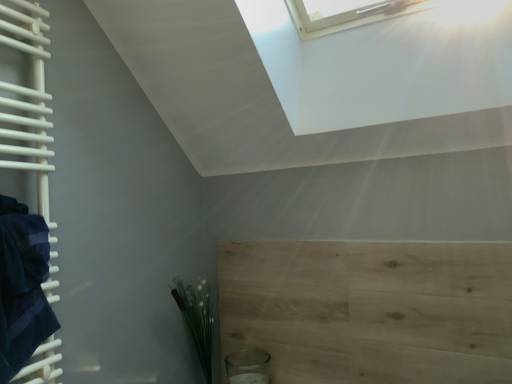
Question: Are green matte plant at lower left and dark blue towel at left far apart?

Choices:
 (A) yes
 (B) no

Answer: (B)

Question: Can you confirm if green matte plant at lower left is positioned to the left of dark blue towel at left?

Choices:
 (A) yes
 (B) no

Answer: (B)

Question: Can you confirm if green matte plant at lower left is shorter than dark blue towel at left?

Choices:
 (A) yes
 (B) no

Answer: (A)

Question: Does green matte plant at lower left lie in front of dark blue towel at left?

Choices:
 (A) yes
 (B) no

Answer: (B)

Question: Is green matte plant at lower left oriented towards dark blue towel at left?

Choices:
 (A) no
 (B) yes

Answer: (B)

Question: Looking at their shapes, would you say green matte plant at lower left is wider or thinner than dark blue towel at left?

Choices:
 (A) wide
 (B) thin

Answer: (A)

Question: Is green matte plant at lower left bigger or smaller than dark blue towel at left?

Choices:
 (A) big
 (B) small

Answer: (B)

Question: From the image's perspective, relative to dark blue towel at left, is green matte plant at lower left above or below?

Choices:
 (A) above
 (B) below

Answer: (B)

Question: Choose the correct answer: Is green matte plant at lower left inside dark blue towel at left or outside it?

Choices:
 (A) outside
 (B) inside

Answer: (A)

Question: Relative to green matte plant at lower left, is light wood plywood at lower right in front or behind?

Choices:
 (A) front
 (B) behind

Answer: (A)

Question: Is light wood plywood at lower right to the left or to the right of green matte plant at lower left in the image?

Choices:
 (A) right
 (B) left

Answer: (A)

Question: Is light wood plywood at lower right inside or outside of green matte plant at lower left?

Choices:
 (A) inside
 (B) outside

Answer: (B)

Question: Is light wood plywood at lower right taller or shorter than green matte plant at lower left?

Choices:
 (A) tall
 (B) short

Answer: (A)

Question: Is green matte plant at lower left spatially inside light wood plywood at lower right, or outside of it?

Choices:
 (A) outside
 (B) inside

Answer: (A)

Question: From their relative heights in the image, would you say green matte plant at lower left is taller or shorter than light wood plywood at lower right?

Choices:
 (A) tall
 (B) short

Answer: (B)